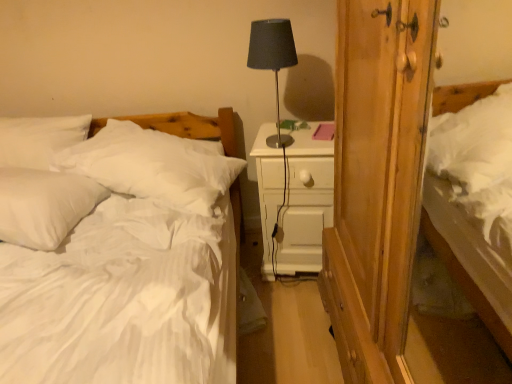
Question: Should I look upward or downward to see wooden wardrobe at right?

Choices:
 (A) down
 (B) up

Answer: (A)

Question: Could you tell me if white wood nightstand at center is facing wooden wardrobe at right?

Choices:
 (A) yes
 (B) no

Answer: (B)

Question: From the image's perspective, is white wood nightstand at center over wooden wardrobe at right?

Choices:
 (A) yes
 (B) no

Answer: (A)

Question: Considering the relative sizes of white wood nightstand at center and wooden wardrobe at right in the image provided, is white wood nightstand at center taller than wooden wardrobe at right?

Choices:
 (A) yes
 (B) no

Answer: (B)

Question: From the image's perspective, is white wood nightstand at center under wooden wardrobe at right?

Choices:
 (A) yes
 (B) no

Answer: (B)

Question: Is white wood nightstand at center positioned beyond the bounds of wooden wardrobe at right?

Choices:
 (A) no
 (B) yes

Answer: (B)

Question: Would you say white wood nightstand at center is a long distance from wooden wardrobe at right?

Choices:
 (A) no
 (B) yes

Answer: (A)

Question: Is there a large distance between white soft bed at left and wooden wardrobe at right?

Choices:
 (A) no
 (B) yes

Answer: (A)

Question: From the image's perspective, does white soft bed at left appear higher than wooden wardrobe at right?

Choices:
 (A) yes
 (B) no

Answer: (B)

Question: Considering the relative sizes of white soft bed at left and wooden wardrobe at right in the image provided, is white soft bed at left bigger than wooden wardrobe at right?

Choices:
 (A) yes
 (B) no

Answer: (A)

Question: Is white soft bed at left positioned beyond the bounds of wooden wardrobe at right?

Choices:
 (A) yes
 (B) no

Answer: (A)

Question: From a real-world perspective, is white soft bed at left physically above wooden wardrobe at right?

Choices:
 (A) yes
 (B) no

Answer: (B)

Question: Is wooden wardrobe at right at the back of white soft bed at left?

Choices:
 (A) yes
 (B) no

Answer: (B)

Question: Does white soft pillow at left, the 1th pillow from the right, have a larger size compared to white soft bed at left?

Choices:
 (A) yes
 (B) no

Answer: (B)